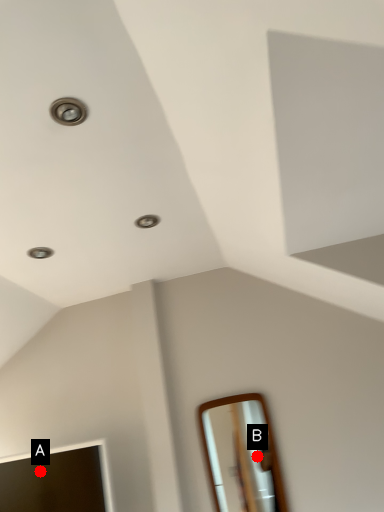
Question: Two points are circled on the image, labeled by A and B beside each circle. Among these points, which one is nearest to the camera?

Choices:
 (A) A is closer
 (B) B is closer

Answer: (A)